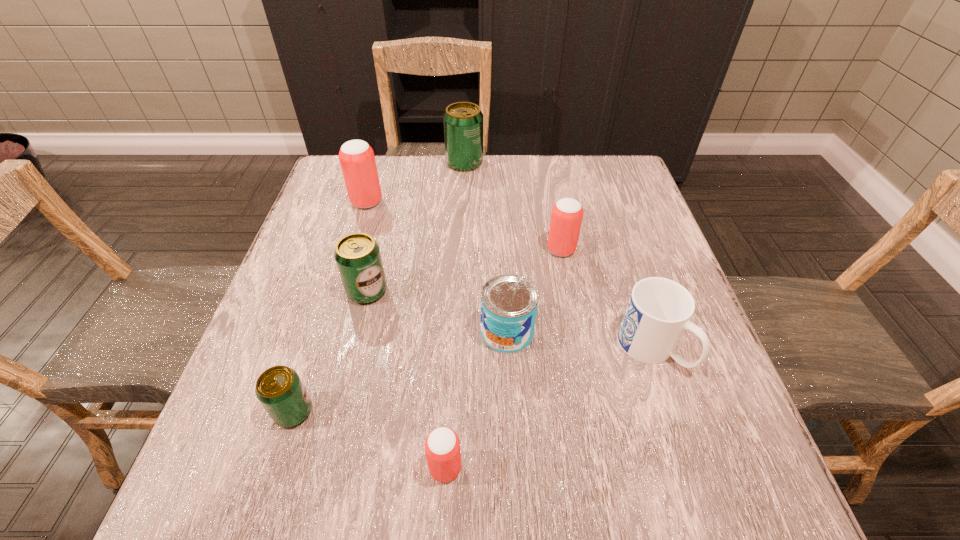
Where is `can`? can is located at coordinates (509, 302).

Find the location of a particular element. This screenshot has height=540, width=960. the nearest green beer can is located at coordinates (279, 389).

You are a GUI agent. You are given a task and a screenshot of the screen. Output one action in this format:
    pyautogui.click(x=<x>, y=<y>)
    Task: Click on the smallest green beer can
    The width and height of the screenshot is (960, 540).
    Given the screenshot: What is the action you would take?
    pyautogui.click(x=279, y=389)

You are a GUI agent. You are given a task and a screenshot of the screen. Output one action in this format:
    pyautogui.click(x=<x>, y=<y>)
    Task: Click on the smallest red beer can
    The width and height of the screenshot is (960, 540).
    Given the screenshot: What is the action you would take?
    pyautogui.click(x=442, y=446)

Locate an element on the screen. the nearest object is located at coordinates (442, 446).

Find the location of a particular element. Image resolution: width=960 pixels, height=540 pixels. vacant space located 0.250m on the left of the rightmost green beer can is located at coordinates (362, 163).

Where is `free point located on the front of the fifth nearest beer can`? free point located on the front of the fifth nearest beer can is located at coordinates (346, 272).

I want to click on vacant region located 0.140m on the right of the rightmost beer can, so click(x=635, y=249).

The width and height of the screenshot is (960, 540). What are the coordinates of `vacant space located on the front of the third nearest beer can` in the screenshot? It's located at (356, 338).

In order to click on vacant area situated 0.380m on the back of the rightmost object in this screenshot , I will do `click(606, 206)`.